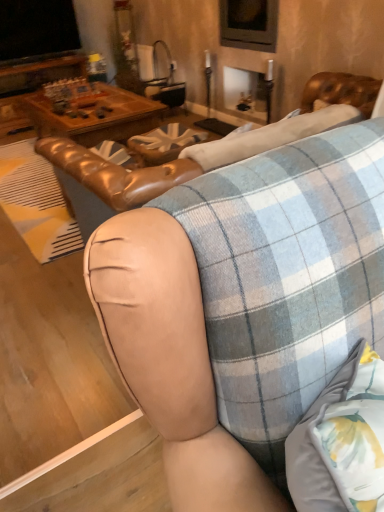
The width and height of the screenshot is (384, 512). What do you see at coordinates (244, 306) in the screenshot?
I see `leather couch at center` at bounding box center [244, 306].

Image resolution: width=384 pixels, height=512 pixels. In order to click on leather couch at center in this screenshot , I will do `click(244, 306)`.

Identify the location of leather at center. (177, 160).

What do you see at coordinates (177, 160) in the screenshot?
I see `leather at center` at bounding box center [177, 160].

Find the location of a particular element. This screenshot has width=384, height=512. leather couch at center is located at coordinates (244, 306).

Is leather at center to the left of leather couch at center from the viewer's perspective?

Incorrect, leather at center is not on the left side of leather couch at center.

Is the depth of leather at center greater than that of leather couch at center?

No, leather at center is closer to the camera.

Which is nearer, (123, 183) or (162, 362)?

The point (162, 362) is in front.

From the image's perspective, is leather at center above or below leather couch at center?

From the image's perspective, leather at center appears below leather couch at center.

From a real-world perspective, which object rests below the other?

leather couch at center is physically lower.

Does leather at center have a greater width compared to leather couch at center?

Incorrect, the width of leather at center does not surpass that of leather couch at center.

From their relative heights in the image, would you say leather at center is taller or shorter than leather couch at center?

leather at center is taller than leather couch at center.

Considering the relative sizes of leather at center and leather couch at center in the image provided, is leather at center smaller than leather couch at center?

Actually, leather at center might be larger than leather couch at center.

Is leather couch at center located within leather at center?

No.

Are leather at center and leather couch at center located far from each other?

No, leather at center is not far away from leather couch at center.

Is leather at center aimed at leather couch at center?

Yes, leather at center is aimed at leather couch at center.

The height and width of the screenshot is (512, 384). Find the location of `studio couch lying on the left of leather at center`. studio couch lying on the left of leather at center is located at coordinates (244, 306).

Is leather couch at center at the right side of leather at center?

No, leather couch at center is not to the right of leather at center.

Considering their positions, is leather couch at center located in front of or behind leather at center?

In the image, leather couch at center appears behind leather at center.

Is point (166, 445) in front of point (54, 142)?

Yes, point (166, 445) is in front of point (54, 142).

From the image's perspective, is leather couch at center under leather at center?

No.

From a real-world perspective, is leather couch at center physically above leather at center?

No, from a real-world perspective, leather couch at center is not on top of leather at center.

In the scene shown: Considering the relative sizes of leather couch at center and leather at center in the image provided, is leather couch at center thinner than leather at center?

Incorrect, the width of leather couch at center is not less than that of leather at center.

Considering the relative sizes of leather couch at center and leather at center in the image provided, is leather couch at center shorter than leather at center?

Indeed, leather couch at center has a lesser height compared to leather at center.

Can you confirm if leather couch at center is bigger than leather at center?

Incorrect, leather couch at center is not larger than leather at center.

Is leather couch at center situated inside leather at center or outside?

leather couch at center is not inside leather at center, it's outside.

Is the surface of leather couch at center in direct contact with leather at center?

No.

Is leather couch at center oriented away from leather at center?

No, leather couch at center is not facing away from leather at center.

How many degrees apart are the facing directions of leather couch at center and leather at center?

178 degrees.

Where is `studio couch behind the leather at center`? studio couch behind the leather at center is located at coordinates (244, 306).

Locate an element on the screen. studio couch that appears below the leather at center (from a real-world perspective) is located at coordinates (244, 306).

I want to click on studio couch located on the left of leather at center, so click(x=244, y=306).